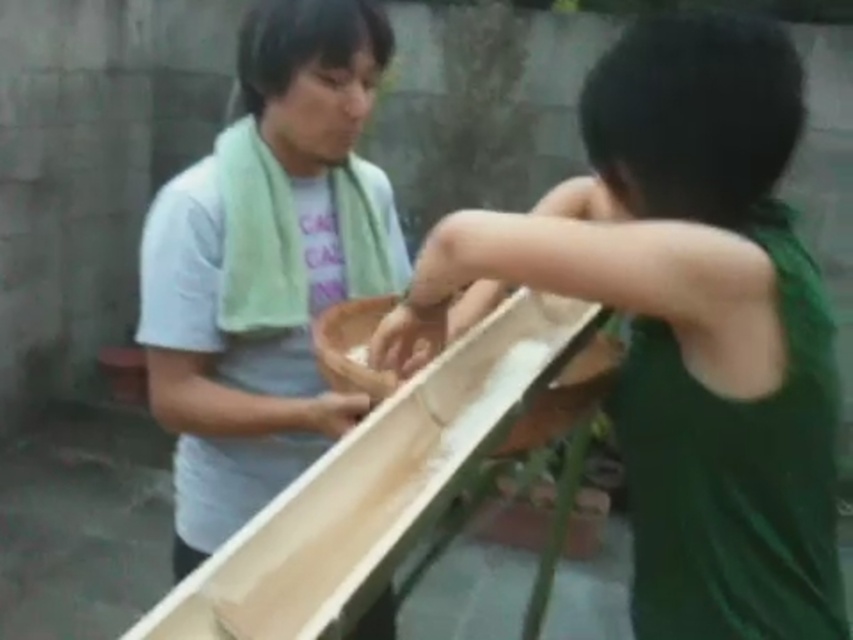
Is green fabric shirt at right wider than smooth wooden trough at center?

Yes.

Does green fabric shirt at right appear over smooth wooden trough at center?

Yes.

Who is more distant from viewer, (634, 321) or (416, 422)?

Point (634, 321)

I want to click on green fabric shirt at right, so click(x=683, y=323).